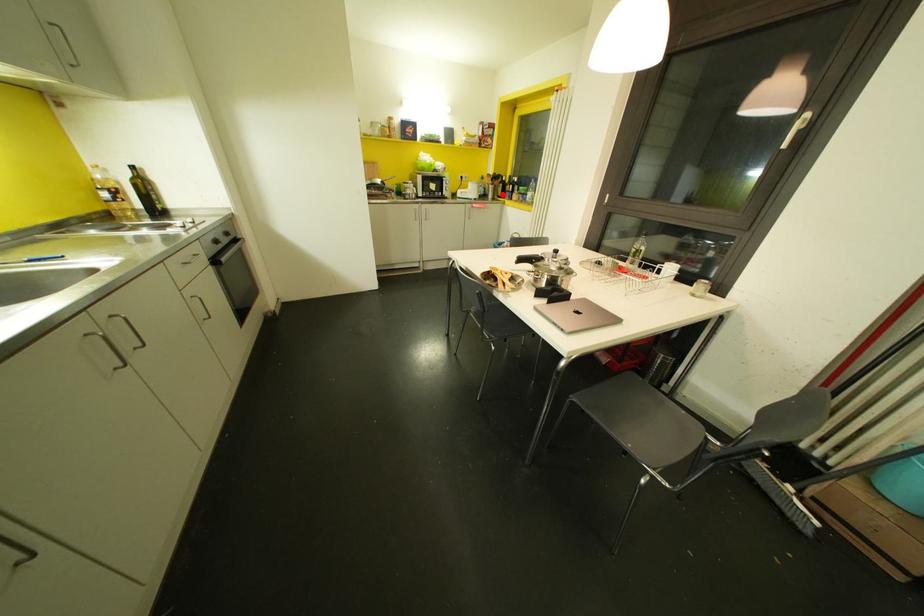
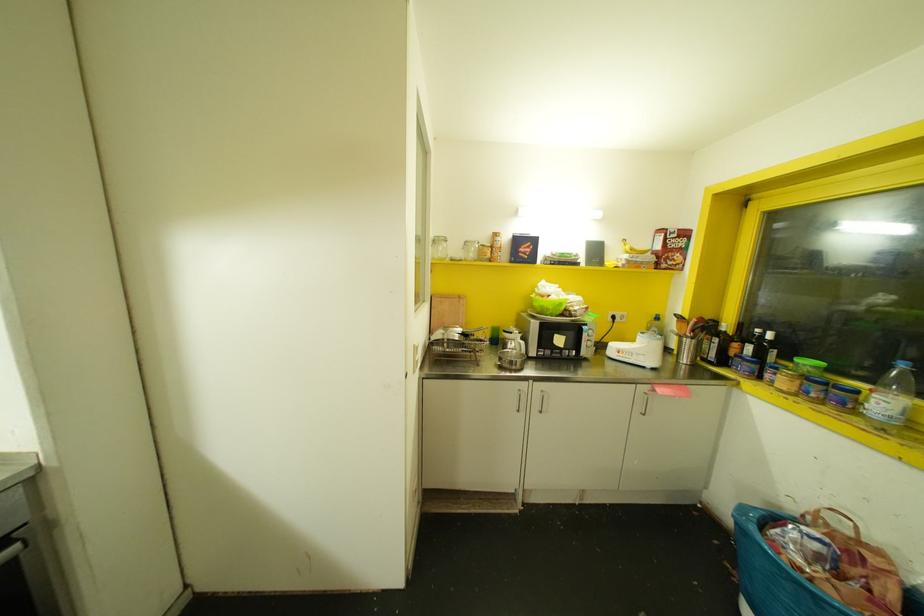
Question: I am providing you with two images of the same scene from different viewpoints. A red point is shown in image1. For the corresponding object point in image2, is it positioned nearer or farther from the camera?

Choices:
 (A) Nearer
 (B) Farther

Answer: (B)